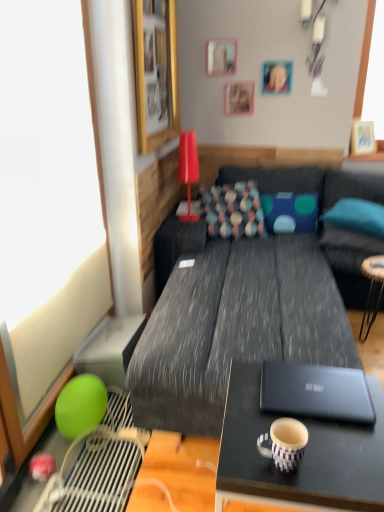
This screenshot has height=512, width=384. I want to click on free space in front of porcelain textured mug at center, so click(292, 482).